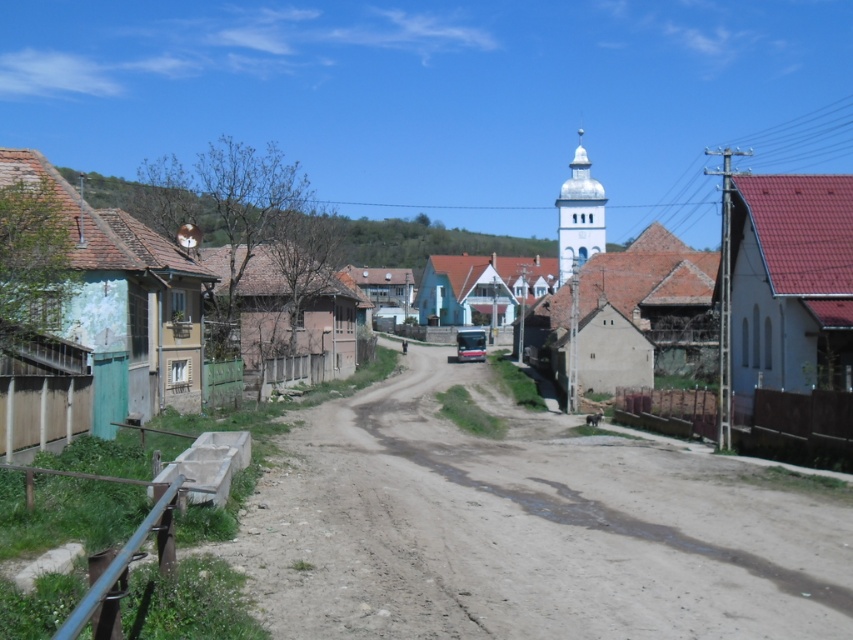
You are a delivery driver approaching the village and need to reach the white stucco church at center. According to the scene, where should you look for the matte concrete road at center in relation to the church?

The matte concrete road at center is located below the white stucco church at center, so you should look downward or below the church to find the road.

You are driving a metallic silver car at center and want to cross over the matte concrete road at center. Is the height of your car sufficient to pass under the bridge ahead?

The matte concrete road at center is taller than metallic silver car at center, so the car can pass under the bridge without any issues.